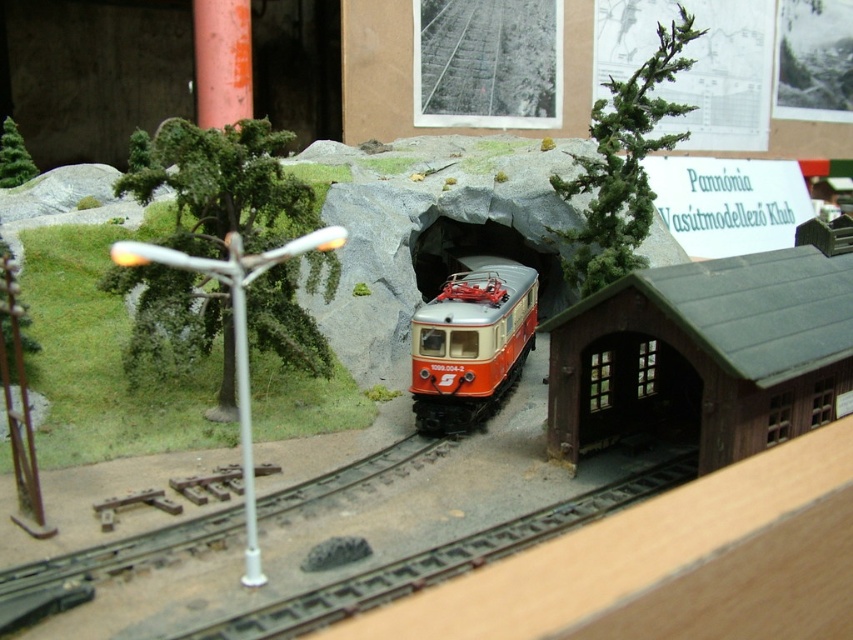
Question: Which of the following is the closest to the observer?

Choices:
 (A) green textured tree at left
 (B) smooth metal train track at center

Answer: (B)

Question: Does brown metal train track at lower center appear over smooth metal train track at center?

Choices:
 (A) yes
 (B) no

Answer: (B)

Question: Is the position of matte orange train at center less distant than that of green textured pine tree at upper left?

Choices:
 (A) yes
 (B) no

Answer: (A)

Question: Estimate the real-world distances between objects in this image. Which object is closer to the brown metal train track at lower center?

Choices:
 (A) matte orange train at center
 (B) smooth metal train track at center
 (C) green textured tree at upper center

Answer: (B)

Question: Does matte orange train at center have a greater width compared to smooth metal train track at center?

Choices:
 (A) yes
 (B) no

Answer: (B)

Question: Which object is closer to the camera taking this photo?

Choices:
 (A) green textured tree at upper center
 (B) smooth metal train track at center

Answer: (B)